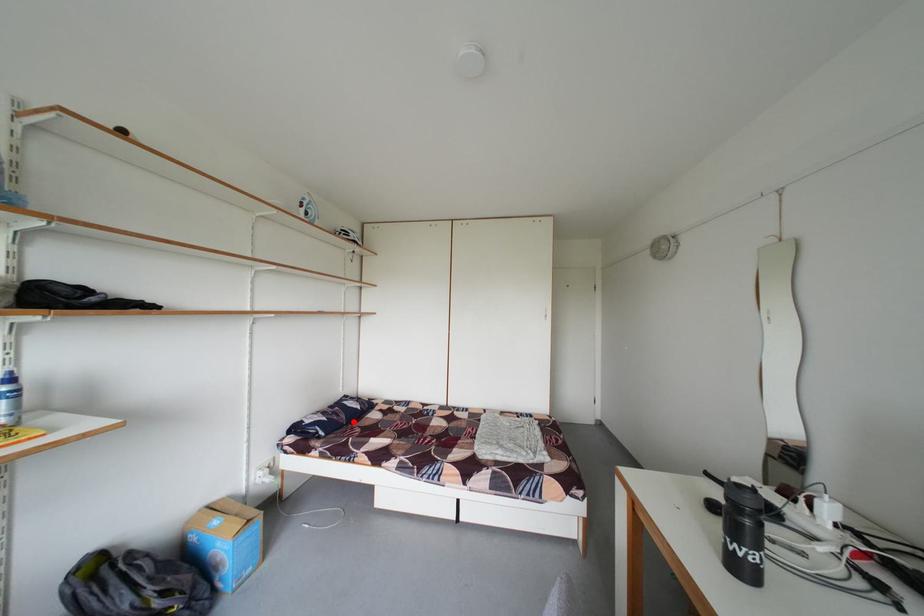
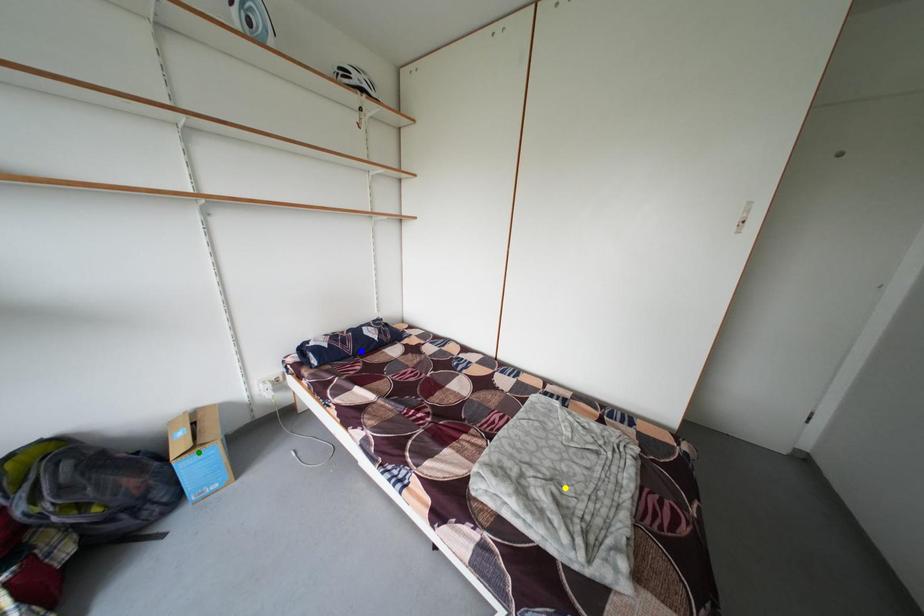
Question: I am providing you with two images of the same scene from different viewpoints. A red point is marked on the first image. You are given multiple points on the second image. Which point in image 2 represents the same 3d spot as the red point in image 1?

Choices:
 (A) green point
 (B) yellow point
 (C) blue point

Answer: (C)